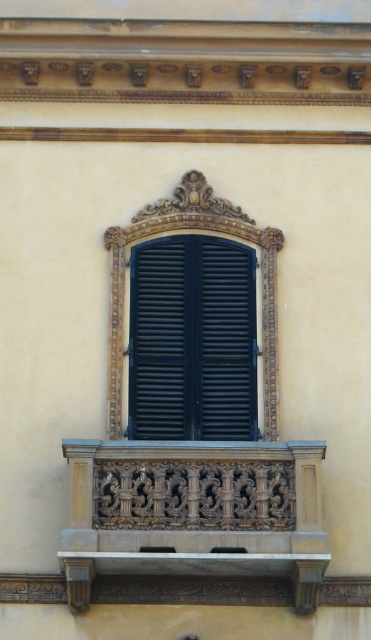
Question: Is carved wood balcony at lower center to the right of matte black shutters at center from the viewer's perspective?

Choices:
 (A) no
 (B) yes

Answer: (B)

Question: Observing the image, what is the correct spatial positioning of carved wood balcony at lower center in reference to matte black shutters at center?

Choices:
 (A) below
 (B) above

Answer: (A)

Question: Among these points, which one is nearest to the camera?

Choices:
 (A) (241, 387)
 (B) (297, 481)

Answer: (B)

Question: Can you confirm if carved wood balcony at lower center is positioned above matte black shutters at center?

Choices:
 (A) no
 (B) yes

Answer: (A)

Question: Which point is closer to the camera taking this photo?

Choices:
 (A) (280, 557)
 (B) (149, 280)

Answer: (A)